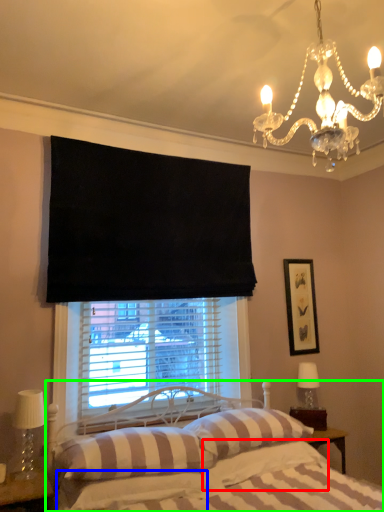
Question: Considering the real-world distances, which object is closest to pillow (highlighted by a red box)? sheet (highlighted by a blue box) or bed (highlighted by a green box).

Choices:
 (A) sheet
 (B) bed

Answer: (B)